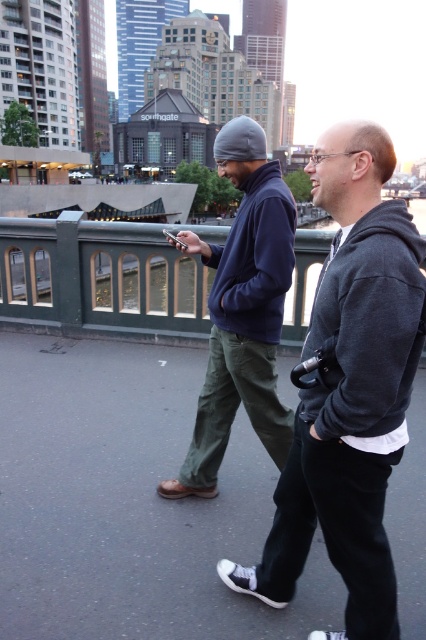
You are a city planner analyzing pedestrian pathways. You observe the dark gray hoodie at center and the green matte railing at center. Which object occupies a wider space in the scene?

The green matte railing at center is wider than the dark gray hoodie at center.

You are standing on a bridge or walkway in a city. You want to place your backpack on the green matte railing at center. Is the railing at that location stable enough to hold your backpack?

The green matte railing at center is located at point (100, 276), so yes, it is stable enough to hold your backpack.

You are a pedestrian trying to cross the bridge. There is a green matte railing at center and a dark gray fleece at center. Which object is closer to the left side of the bridge?

The green matte railing at center is closer to the left side of the bridge because it is positioned to the left of the dark gray fleece at center.